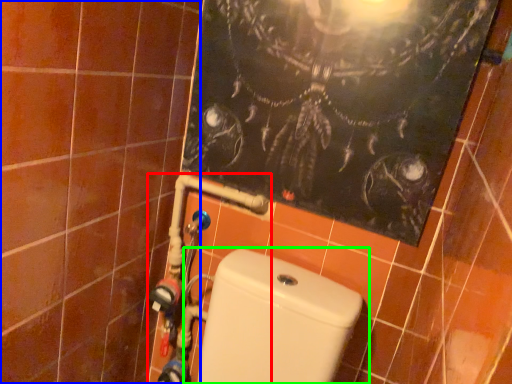
Question: Which object is the farthest from water pipe (highlighted by a red box)? Choose among these: ceramic tile (highlighted by a blue box) or toilet (highlighted by a green box).

Choices:
 (A) ceramic tile
 (B) toilet

Answer: (A)